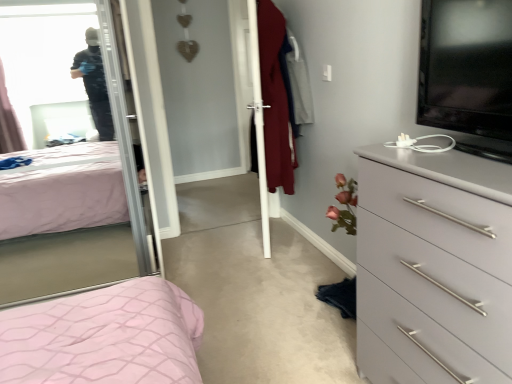
The image size is (512, 384). What are the coordinates of `free location to the right of clear glass mirror at upper left` in the screenshot? It's located at (215, 260).